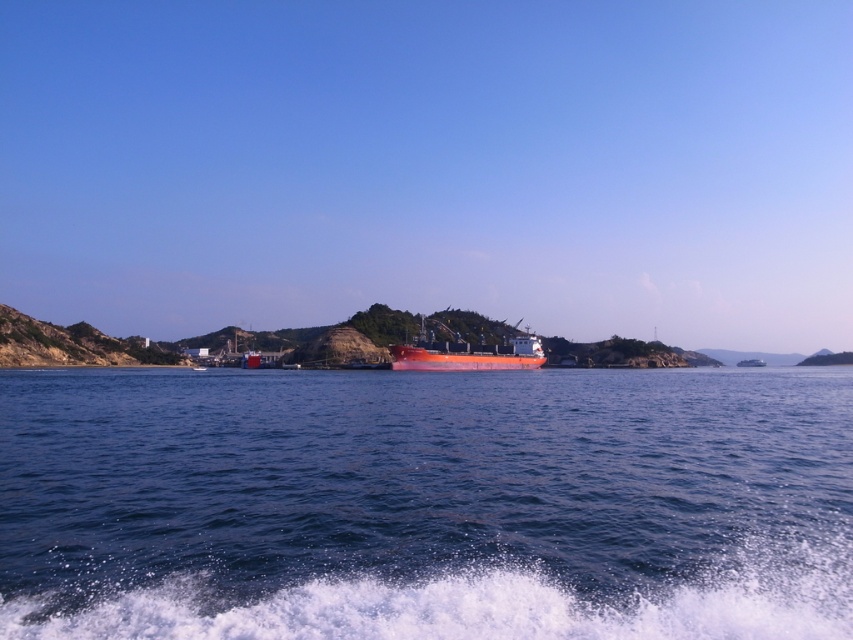
You are a marine biologist observing the scene from a cliff overlooking the water. You need to collect water samples from the blue water at center and analyze them. However, your boat can only safely approach within 50 meters of the matte orange ship at center. Can you safely collect the samples without getting too close to the ship?

The blue water at center is 48.05 meters away from the matte orange ship at center. Since your boat can approach within 50 meters, you can safely collect the samples as the distance is within the safe limit.

Consider the image. You are a drone operator trying to capture a photo of the blue water at center and the matte orange ship at center. Which object appears taller in the image?

The matte orange ship at center appears taller than the blue water at center in the image.